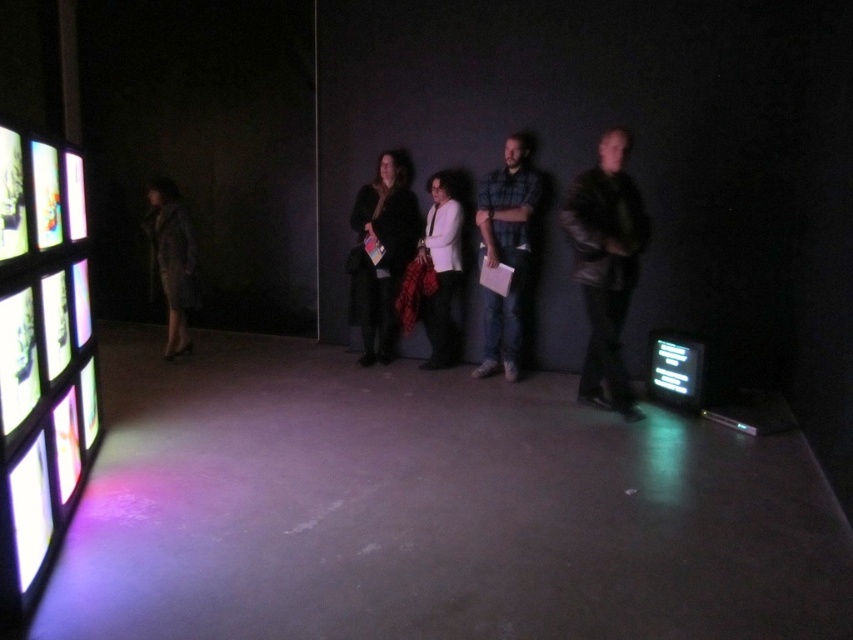
Question: Is white matte coat at center positioned before matte gray coat at left?

Choices:
 (A) no
 (B) yes

Answer: (B)

Question: Among these points, which one is nearest to the camera?

Choices:
 (A) (601, 182)
 (B) (456, 259)

Answer: (A)

Question: Is plaid flannel shirt at center closer to the viewer compared to black glossy screen at lower right?

Choices:
 (A) yes
 (B) no

Answer: (B)

Question: Can you confirm if black wool coat at center is bigger than matte gray coat at left?

Choices:
 (A) no
 (B) yes

Answer: (A)

Question: Which point is closer to the camera?

Choices:
 (A) black wool coat at center
 (B) white matte coat at center
 (C) matte gray coat at left
 (D) black glossy screen at lower right

Answer: (D)

Question: Among these objects, which one is farthest from the camera?

Choices:
 (A) matte gray coat at left
 (B) black glossy screen at lower right

Answer: (A)